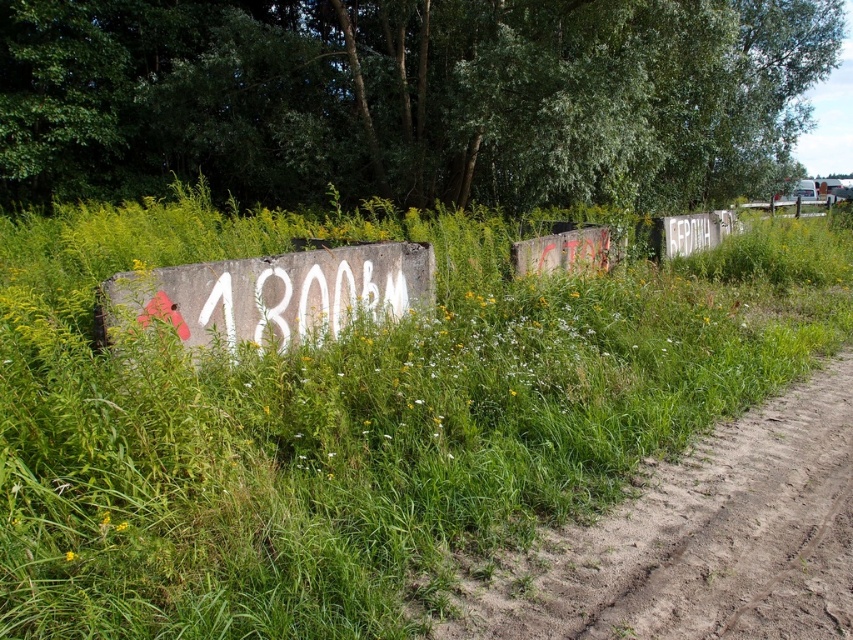
Question: Can you confirm if green grass at center is thinner than white painted concrete sign at center?

Choices:
 (A) yes
 (B) no

Answer: (B)

Question: Does brown sandy dirt track at lower right have a smaller size compared to white painted graffiti at center?

Choices:
 (A) no
 (B) yes

Answer: (A)

Question: Which object appears closest to the camera in this image?

Choices:
 (A) white painted concrete sign at center
 (B) brown sandy dirt track at lower right
 (C) green grass at center

Answer: (C)

Question: Which is farther from the white painted graffiti at center?

Choices:
 (A) brown sandy dirt track at lower right
 (B) white painted concrete sign at center
 (C) green grass at center

Answer: (A)

Question: Estimate the real-world distances between objects in this image. Which object is farther from the white painted concrete sign at center?

Choices:
 (A) brown sandy dirt track at lower right
 (B) green grass at center
 (C) white painted graffiti at center

Answer: (A)

Question: Does brown sandy dirt track at lower right appear on the right side of white painted graffiti at center?

Choices:
 (A) yes
 (B) no

Answer: (A)